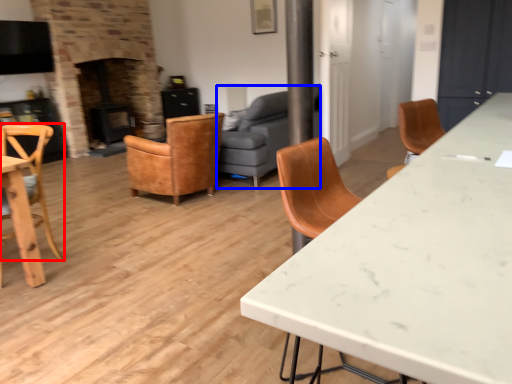
Question: Which object is further to the camera taking this photo, chair (highlighted by a red box) or studio couch (highlighted by a blue box)?

Choices:
 (A) chair
 (B) studio couch

Answer: (B)